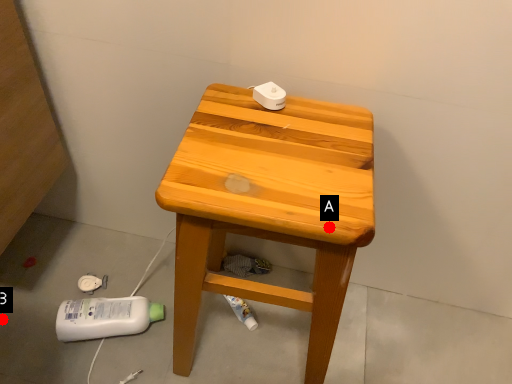
Question: Two points are circled on the image, labeled by A and B beside each circle. Which point is farther from the camera taking this photo?

Choices:
 (A) A is further
 (B) B is further

Answer: (B)